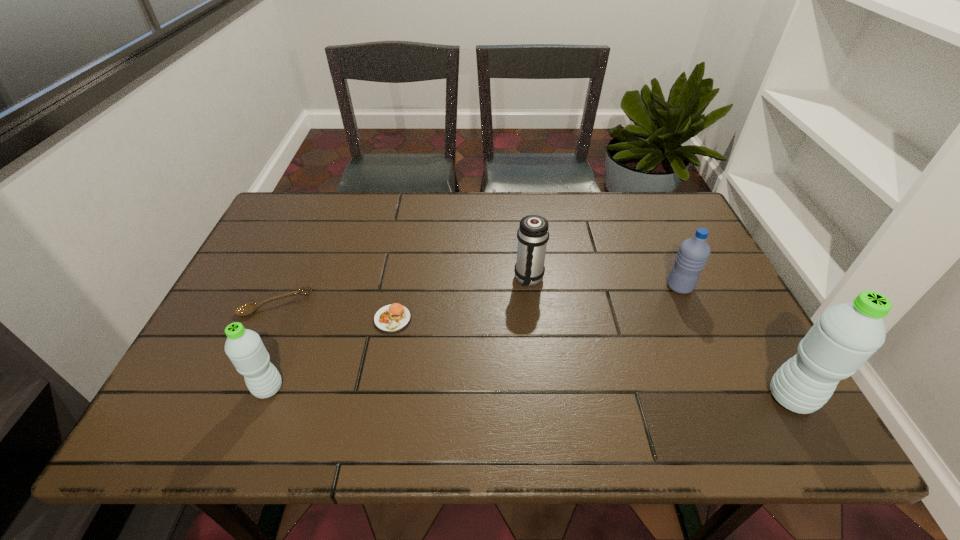
Find the location of a particular element. Image resolution: width=960 pixels, height=540 pixels. free spot located 0.080m on the left of the tallest object is located at coordinates (730, 397).

What are the coordinates of `free space located on the side with the handle of the third object from right to left` in the screenshot? It's located at (537, 347).

This screenshot has width=960, height=540. I want to click on free spot located 0.120m on the back of the patty, so click(401, 272).

Where is `vacant space located on the front of the second object from right to left`? Image resolution: width=960 pixels, height=540 pixels. vacant space located on the front of the second object from right to left is located at coordinates (709, 354).

The height and width of the screenshot is (540, 960). Find the location of `free location located 0.400m on the right of the shortest object`. free location located 0.400m on the right of the shortest object is located at coordinates (468, 304).

The height and width of the screenshot is (540, 960). What are the coordinates of `water bottle at the left edge` in the screenshot? It's located at (244, 347).

This screenshot has width=960, height=540. What are the coordinates of `ladle at the left edge` in the screenshot? It's located at (246, 309).

This screenshot has width=960, height=540. Identify the location of object located at the near left corner. (244, 347).

At what (x,y) coordinates should I click in order to perform the action: click on object that is positioned at the near right corner. Please return your answer as a coordinate pair (x, y). Looking at the image, I should click on (845, 336).

This screenshot has width=960, height=540. What are the coordinates of `blank space at the far edge of the desktop` in the screenshot? It's located at (554, 218).